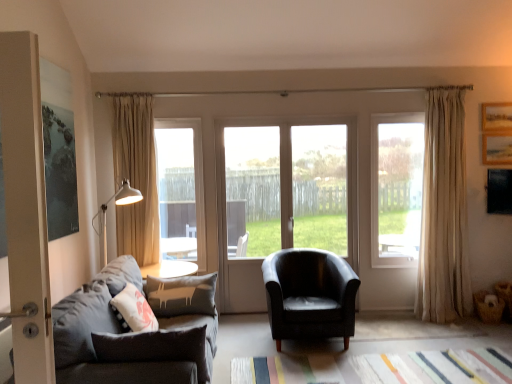
Question: From the image's perspective, is wooden picture frame at upper right below clear glass window at center, which is the 1th window from right to left?

Choices:
 (A) no
 (B) yes

Answer: (A)

Question: Can you confirm if wooden picture frame at upper right is taller than clear glass window at center, which is the 1th window from right to left?

Choices:
 (A) no
 (B) yes

Answer: (A)

Question: Considering the relative sizes of wooden picture frame at upper right and clear glass window at center, the 3th window from the left, in the image provided, is wooden picture frame at upper right wider than clear glass window at center, the 3th window from the left,?

Choices:
 (A) yes
 (B) no

Answer: (B)

Question: Is wooden picture frame at upper right bigger than clear glass window at center, the 3th window from the left?

Choices:
 (A) no
 (B) yes

Answer: (A)

Question: From a real-world perspective, is wooden picture frame at upper right on clear glass window at center, which is the 1th window from right to left?

Choices:
 (A) no
 (B) yes

Answer: (B)

Question: Considering the relative positions of wooden picture frame at upper right and clear glass window at center, which is the 1th window from right to left, in the image provided, is wooden picture frame at upper right behind clear glass window at center, which is the 1th window from right to left,?

Choices:
 (A) no
 (B) yes

Answer: (B)

Question: Considering the relative sizes of clear glass door at center, which is counted as the third window, starting from the right, and transparent glass door at center, which ranks as the second window in right-to-left order, in the image provided, is clear glass door at center, which is counted as the third window, starting from the right, bigger than transparent glass door at center, which ranks as the second window in right-to-left order,?

Choices:
 (A) yes
 (B) no

Answer: (B)

Question: Is clear glass door at center, which is counted as the third window, starting from the right, not close to transparent glass door at center, which ranks as the second window in right-to-left order?

Choices:
 (A) yes
 (B) no

Answer: (A)

Question: Is clear glass door at center, positioned as the first window in left-to-right order, shorter than transparent glass door at center, which is the 2th window from left to right?

Choices:
 (A) yes
 (B) no

Answer: (A)

Question: From the image's perspective, would you say clear glass door at center, which is counted as the third window, starting from the right, is shown under transparent glass door at center, which is the 2th window from left to right?

Choices:
 (A) yes
 (B) no

Answer: (B)

Question: From a real-world perspective, is clear glass door at center, positioned as the first window in left-to-right order, on transparent glass door at center, which ranks as the second window in right-to-left order?

Choices:
 (A) no
 (B) yes

Answer: (B)

Question: Considering the relative sizes of clear glass door at center, which is counted as the third window, starting from the right, and transparent glass door at center, which ranks as the second window in right-to-left order, in the image provided, is clear glass door at center, which is counted as the third window, starting from the right, taller than transparent glass door at center, which ranks as the second window in right-to-left order,?

Choices:
 (A) yes
 (B) no

Answer: (B)

Question: Does wooden picture frame at upper right have a lesser height compared to beige fabric curtain at left, acting as the 1th curtain starting from the left?

Choices:
 (A) no
 (B) yes

Answer: (B)